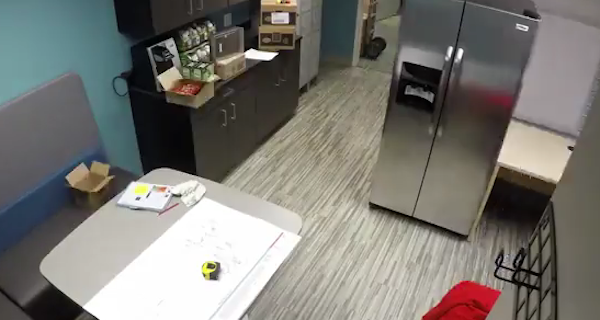
You are a GUI agent. You are given a task and a screenshot of the screen. Output one action in this format:
    pyautogui.click(x=<x>, y=<y>)
    Task: Click on the crumpled red clothing item
    
    Given the screenshot: What is the action you would take?
    pyautogui.click(x=469, y=304)